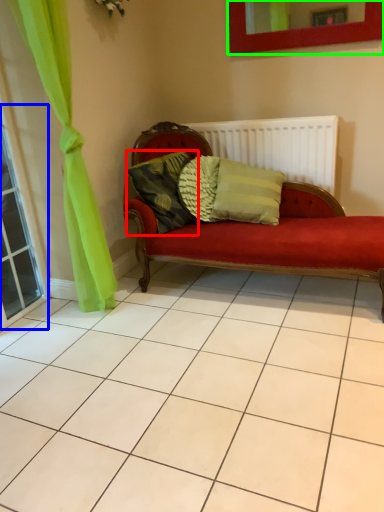
Question: Which is farther away from pillow (highlighted by a red box)? window (highlighted by a blue box) or picture frame (highlighted by a green box)?

Choices:
 (A) window
 (B) picture frame

Answer: (B)